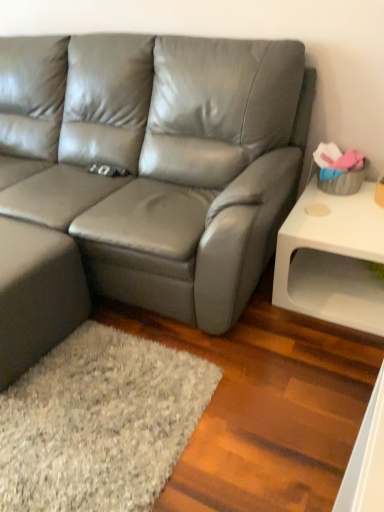
Question: From the image's perspective, is white matte side table at right positioned above or below satin gray leather couch at center?

Choices:
 (A) above
 (B) below

Answer: (B)

Question: Considering their positions, is white matte side table at right located in front of or behind satin gray leather couch at center?

Choices:
 (A) front
 (B) behind

Answer: (B)

Question: From their relative heights in the image, would you say white matte side table at right is taller or shorter than satin gray leather couch at center?

Choices:
 (A) tall
 (B) short

Answer: (B)

Question: Is point (175, 41) closer or farther from the camera than point (296, 249)?

Choices:
 (A) farther
 (B) closer

Answer: (B)

Question: From a real-world perspective, is satin gray leather couch at center physically located above or below white matte side table at right?

Choices:
 (A) below
 (B) above

Answer: (B)

Question: Considering the positions of satin gray leather couch at center and white matte side table at right in the image, is satin gray leather couch at center bigger or smaller than white matte side table at right?

Choices:
 (A) big
 (B) small

Answer: (A)

Question: From the image's perspective, is satin gray leather couch at center positioned above or below white matte side table at right?

Choices:
 (A) above
 (B) below

Answer: (A)